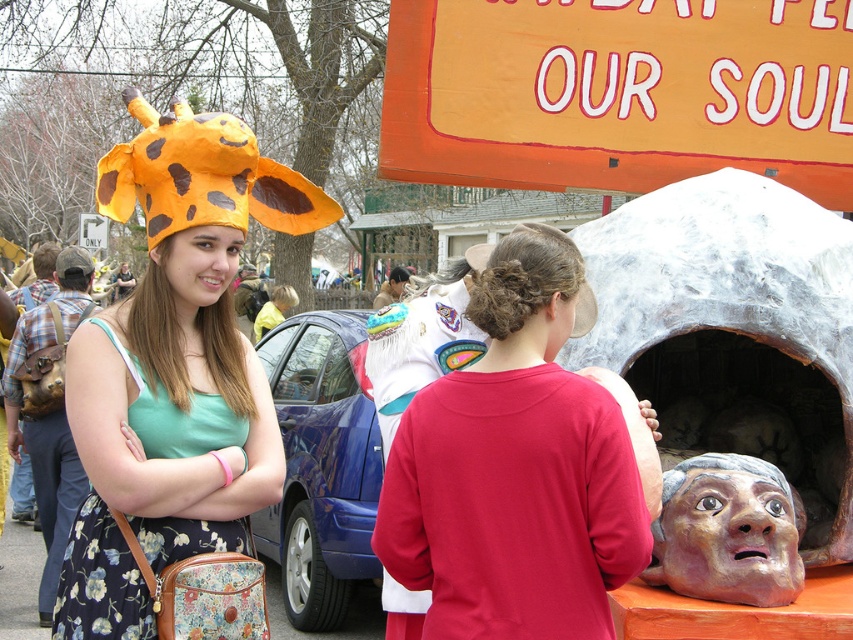
Question: Which point is farther from the camera taking this photo?

Choices:
 (A) (849, 362)
 (B) (77, 340)
 (C) (598, 164)
 (D) (706, 541)

Answer: (C)

Question: From the image, what is the correct spatial relationship of gray stone mask at center in relation to matte gray stone head at center?

Choices:
 (A) left
 (B) right

Answer: (B)

Question: Does orange painted wood sign at upper center appear on the right side of matte gray stone head at center?

Choices:
 (A) no
 (B) yes

Answer: (A)

Question: Which point is farther to the camera?

Choices:
 (A) matte orange paper hat at left
 (B) gray stone mask at center

Answer: (B)

Question: Which of these objects is positioned farthest from the gray stone mask at center?

Choices:
 (A) orange painted wood sign at upper center
 (B) matte orange paper hat at left
 (C) matte gray stone head at center

Answer: (B)

Question: Can you confirm if matte orange paper hat at left is wider than gray stone mask at center?

Choices:
 (A) yes
 (B) no

Answer: (B)